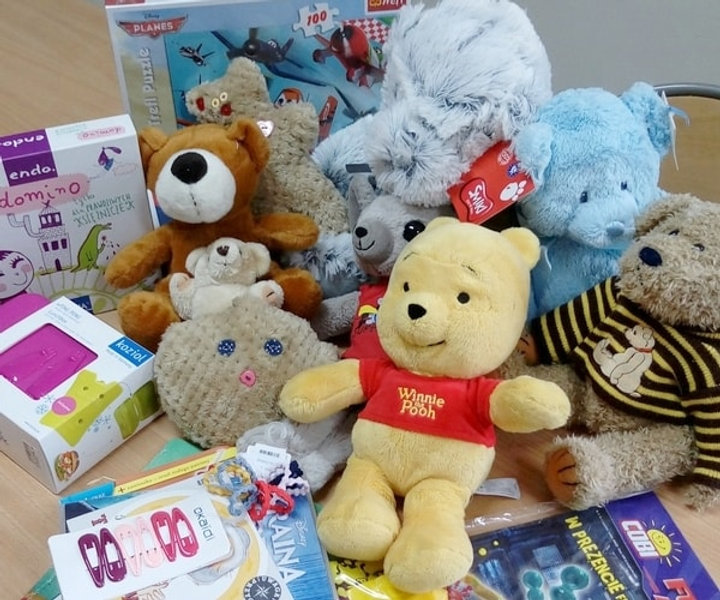
You are a GUI agent. You are given a task and a screenshot of the screen. Output one action in this format:
    pyautogui.click(x=<x>, y=<y>)
    Task: Click on the stuffed animals
    Image resolution: width=720 pixels, height=600 pixels.
    Given the screenshot: What is the action you would take?
    pyautogui.click(x=396, y=391), pyautogui.click(x=246, y=358), pyautogui.click(x=224, y=274), pyautogui.click(x=194, y=228), pyautogui.click(x=276, y=166), pyautogui.click(x=384, y=129), pyautogui.click(x=690, y=288), pyautogui.click(x=379, y=202)